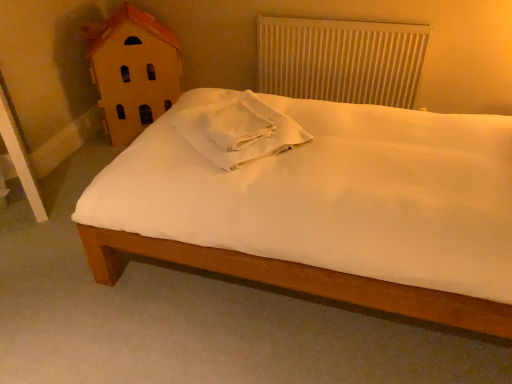
Question: Looking at their shapes, would you say white matte bed at center is wider or thinner than white cotton towel at center?

Choices:
 (A) thin
 (B) wide

Answer: (B)

Question: Is white matte bed at center inside the boundaries of white cotton towel at center, or outside?

Choices:
 (A) outside
 (B) inside

Answer: (A)

Question: Considering the real-world distances, which object is farthest from the white cotton towel at center?

Choices:
 (A) white textured radiator at upper center
 (B) white matte bed at center
 (C) wooden house at left

Answer: (A)

Question: Which object is the closest to the white cotton towel at center?

Choices:
 (A) white matte bed at center
 (B) wooden house at left
 (C) white textured radiator at upper center

Answer: (A)